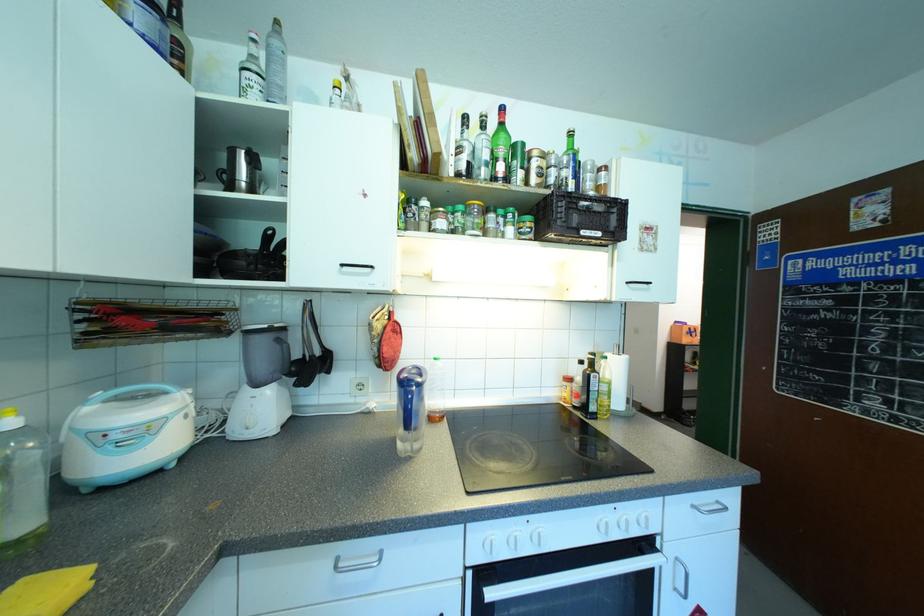
This screenshot has height=616, width=924. Identify the location of metal kettle. (126, 435).